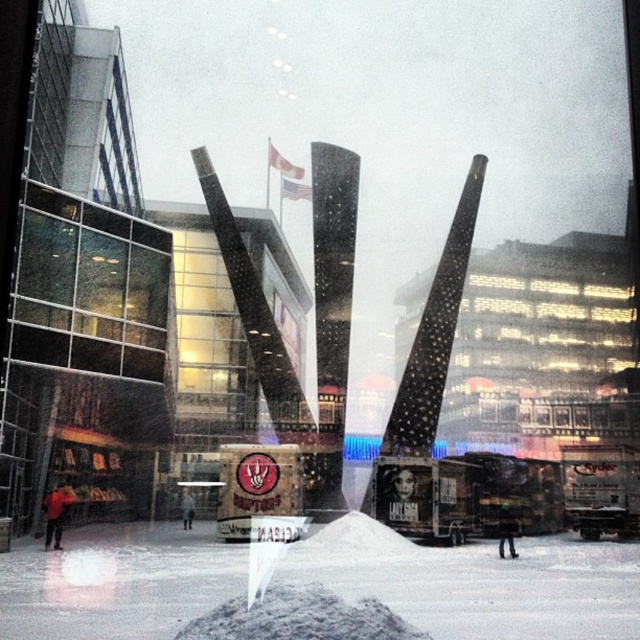
You are a city planner assessing the sculpture area. The white powdery snow at lower center and gray gravel mound at center are both part of the sculpture base. Which one has a greater height?

The white powdery snow at lower center is taller than the gray gravel mound at center, so the snow has a greater height.

You are a city planner inspecting the sculpture area. You see the white powdery snow at lower center and the gray gravel mound at center. Which object is located lower in the scene?

The white powdery snow at lower center is located lower than the gray gravel mound at center.